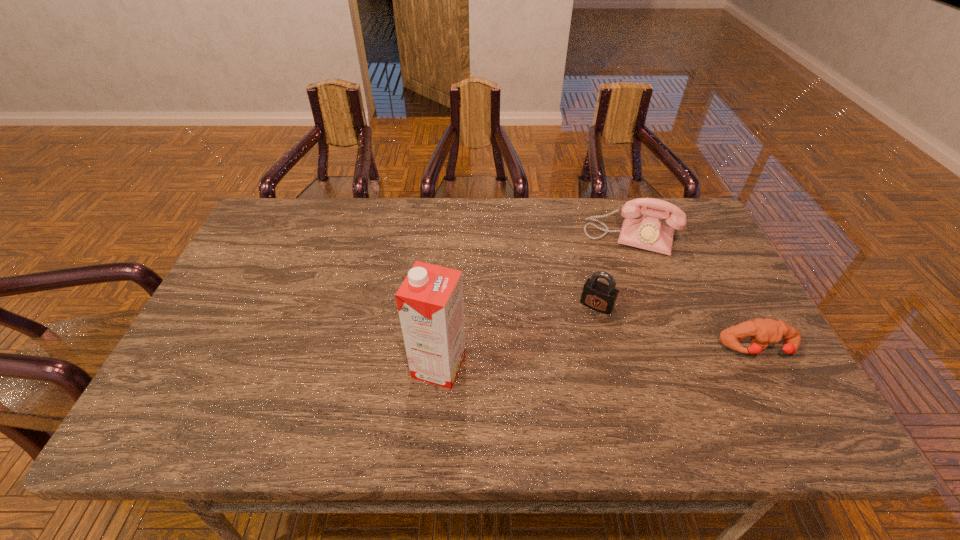
Image resolution: width=960 pixels, height=540 pixels. Identify the location of vacant space situated on the dial of the farthest object. (607, 306).

Identify the location of free point located on the front of the second shortest object near the keyhole. (550, 385).

You are a GUI agent. You are given a task and a screenshot of the screen. Output one action in this format:
    pyautogui.click(x=<x>, y=<y>)
    Task: Click on the vacant area located 0.100m on the front of the second shortest object near the keyhole
    The image size is (960, 540).
    Given the screenshot: What is the action you would take?
    pyautogui.click(x=576, y=340)

Identify the location of free region located 0.070m on the front of the second shortest object near the keyhole. (580, 332).

Locate an element on the screen. This screenshot has height=540, width=960. object located in the far edge section of the desktop is located at coordinates [648, 232].

Image resolution: width=960 pixels, height=540 pixels. I want to click on object at the near edge, so click(430, 300).

Locate an element on the screen. puncher that is at the right edge is located at coordinates (762, 332).

Where is `telephone at the right edge`? telephone at the right edge is located at coordinates point(648,232).

Where is `object situated at the far right corner`? object situated at the far right corner is located at coordinates (648, 232).

Where is `free space at the far edge of the desktop`? The height and width of the screenshot is (540, 960). free space at the far edge of the desktop is located at coordinates (480, 206).